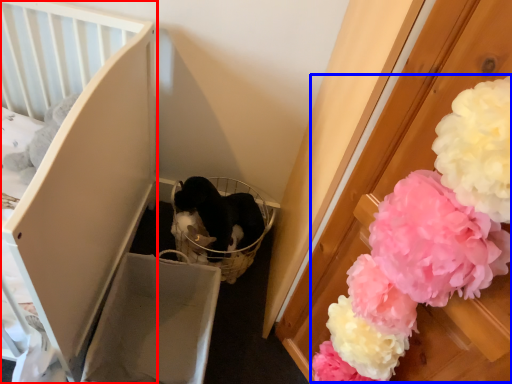
Question: Which of the following is the closest to the observer, furniture (highlighted by a red box) or flower (highlighted by a blue box)?

Choices:
 (A) furniture
 (B) flower

Answer: (B)